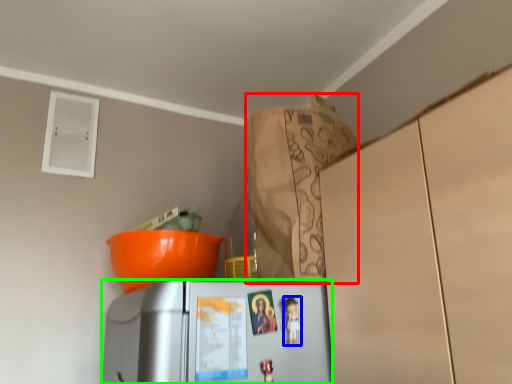
Question: Which object is positioned farthest from paper bag (highlighted by a red box)? Select from toy (highlighted by a blue box) and refrigerator (highlighted by a green box).

Choices:
 (A) toy
 (B) refrigerator

Answer: (A)